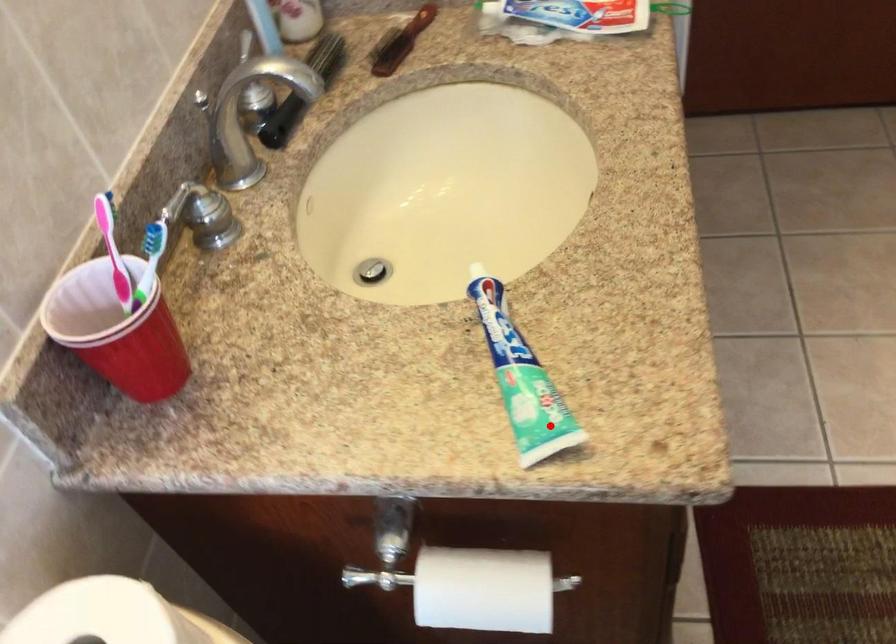
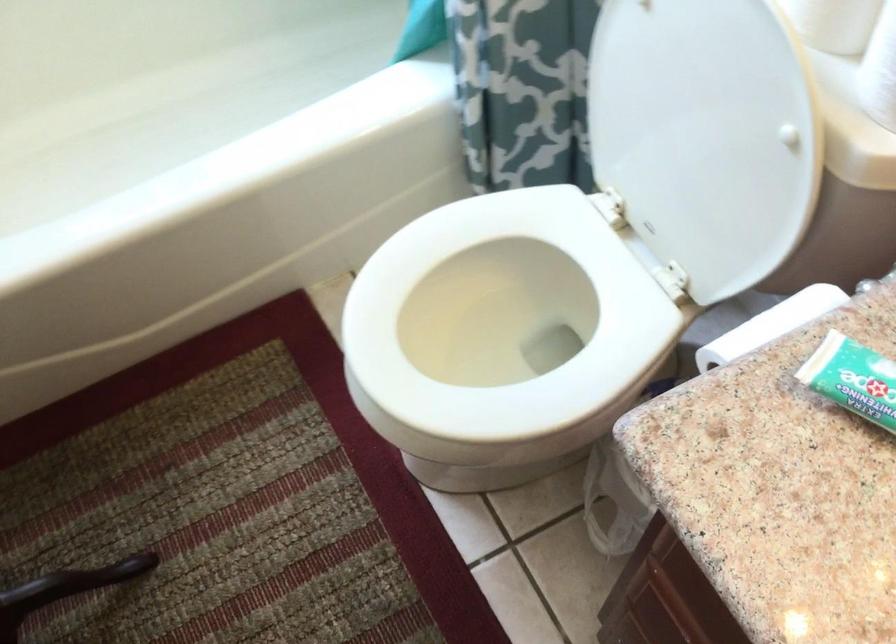
Question: A red point is marked in image1. In image2, is the corresponding 3D point closer to the camera or farther? Reply with the corresponding letter.

Choices:
 (A) The corresponding 3D point is closer.
 (B) The corresponding 3D point is farther.

Answer: (A)